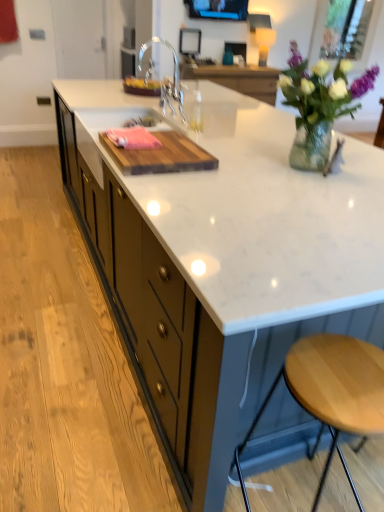
This screenshot has height=512, width=384. In order to click on free space above wooden cutting board at center (from a real-world perspective) in this screenshot , I will do `click(151, 135)`.